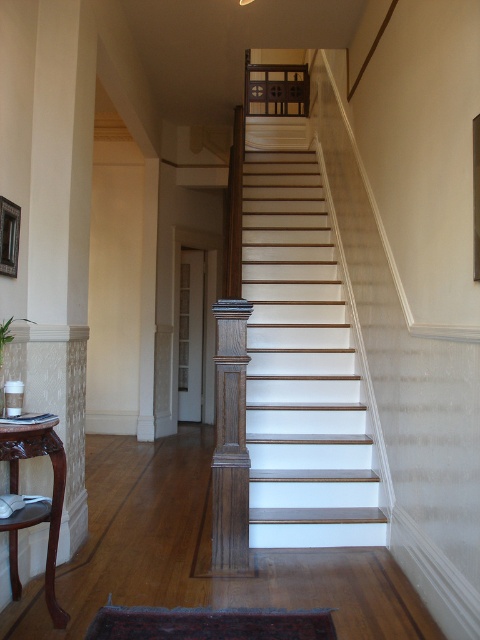
Measure the distance between point [252,346] and camera.

A distance of 4.57 meters exists between point [252,346] and camera.

The height and width of the screenshot is (640, 480). I want to click on white painted wood stairs at center, so click(x=301, y=369).

At what (x,y) coordinates should I click in order to perform the action: click on white painted wood stairs at center. Please return your answer as a coordinate pair (x, y). Image resolution: width=480 pixels, height=640 pixels. Looking at the image, I should click on (301, 369).

Identify the location of white painted wood stairs at center. The image size is (480, 640). (301, 369).

Is white painted wood stairs at center bigger than wooden picture frame at upper left?

Indeed, white painted wood stairs at center has a larger size compared to wooden picture frame at upper left.

This screenshot has height=640, width=480. I want to click on white painted wood stairs at center, so click(301, 369).

This screenshot has height=640, width=480. Identify the location of white painted wood stairs at center. (301, 369).

Is brown wood table at lower left in front of wooden picture frame at upper left?

Yes, it is.

Does brown wood table at lower left have a lesser height compared to wooden picture frame at upper left?

No, brown wood table at lower left is not shorter than wooden picture frame at upper left.

Which is behind, point (48, 595) or point (11, 204)?

The point (11, 204) is more distant.

At what (x,y) coordinates should I click in order to perform the action: click on brown wood table at lower left. Please return your answer as a coordinate pair (x, y). The image size is (480, 640). Looking at the image, I should click on (36, 502).